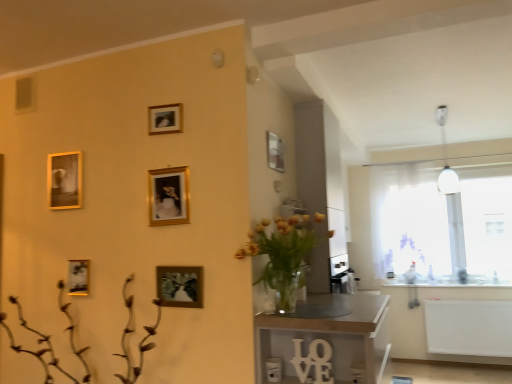
Where is `transparent glass window at right`? This screenshot has width=512, height=384. transparent glass window at right is located at coordinates (441, 224).

The image size is (512, 384). Describe the element at coordinates (165, 119) in the screenshot. I see `gold metallic picture frame at upper center, which is the first picture frame in top-to-bottom order` at that location.

The image size is (512, 384). What do you see at coordinates (413, 231) in the screenshot?
I see `white sheer curtain at right` at bounding box center [413, 231].

What do you see at coordinates (327, 338) in the screenshot? This screenshot has width=512, height=384. I see `wooden table at center` at bounding box center [327, 338].

The height and width of the screenshot is (384, 512). I want to click on wooden table at center, so click(327, 338).

What do you see at coordinates (65, 180) in the screenshot? I see `gold-framed photo at upper left, the 2th picture frame positioned from the top` at bounding box center [65, 180].

You are a GUI agent. You are given a task and a screenshot of the screen. Output one action in this format:
    pyautogui.click(x=<x>, y=<y>)
    Task: Click on the transparent glass window at right
    
    Given the screenshot: What is the action you would take?
    [441, 224]

Could you tell me if translucent glass vase at center is turned towards metallic silver frame at upper center?

No, translucent glass vase at center is not facing towards metallic silver frame at upper center.

Are translucent glass vase at center and metallic silver frame at upper center located far from each other?

No, translucent glass vase at center is in close proximity to metallic silver frame at upper center.

Which point is more distant from viewer, (284,298) or (276,152)?

The point (276,152) is farther from the camera.

Can you confirm if translucent glass vase at center is thinner than metallic silver frame at upper center?

In fact, translucent glass vase at center might be wider than metallic silver frame at upper center.

Does metallic silver frame at upper center turn towards translucent glass vase at center?

No, metallic silver frame at upper center is not turned towards translucent glass vase at center.

Is translucent glass vase at center completely or partially inside metallic silver frame at upper center?

That's incorrect, translucent glass vase at center is not inside metallic silver frame at upper center.

Considering the relative sizes of metallic silver frame at upper center and translucent glass vase at center in the image provided, is metallic silver frame at upper center bigger than translucent glass vase at center?

Incorrect, metallic silver frame at upper center is not larger than translucent glass vase at center.

Could you tell me if translucent glass vase at center is facing brown matte plant at lower left?

No, translucent glass vase at center is not turned towards brown matte plant at lower left.

Is translucent glass vase at center positioned far away from brown matte plant at lower left?

No, translucent glass vase at center is not far away from brown matte plant at lower left.

How different are the orientations of translucent glass vase at center and brown matte plant at lower left in degrees?

They differ by 90 degrees in their facing directions.

Is brown matte plant at lower left surrounded by translucent glass vase at center?

No, brown matte plant at lower left is located outside of translucent glass vase at center.

Can you confirm if gold metallic picture frame at upper center, which is the 3th picture frame in right-to-left order, is smaller than translucent glass vase at center?

Yes.

Considering their positions, is gold metallic picture frame at upper center, which is the 3th picture frame in right-to-left order, located in front of or behind translucent glass vase at center?

gold metallic picture frame at upper center, which is the 3th picture frame in right-to-left order, is behind translucent glass vase at center.

Is point (169, 126) in front of point (306, 231)?

No.

Which is correct: gold metallic picture frame at upper center, which is the third picture frame from left to right, is inside translucent glass vase at center, or outside of it?

gold metallic picture frame at upper center, which is the third picture frame from left to right, is not enclosed by translucent glass vase at center.

Based on their positions, is white sheer curtain at right located to the left or right of wooden table at center?

From the image, it's evident that white sheer curtain at right is to the right of wooden table at center.

Does white sheer curtain at right lie in front of wooden table at center?

No, it is not.

What's the angular difference between white sheer curtain at right and gold metallic picture frame at center, which is counted as the 2th picture frame, starting from the right,'s facing directions?

The angle between the facing direction of white sheer curtain at right and the facing direction of gold metallic picture frame at center, which is counted as the 2th picture frame, starting from the right, is 0.637 degrees.

In the scene shown: From a real-world perspective, is white sheer curtain at right above or below gold metallic picture frame at center, marked as the fourth picture frame in a left-to-right arrangement?

white sheer curtain at right is below gold metallic picture frame at center, marked as the fourth picture frame in a left-to-right arrangement.

Which of these two, white sheer curtain at right or gold metallic picture frame at center, arranged as the third picture frame when viewed from the top, is wider?

white sheer curtain at right is wider.

Is white sheer curtain at right facing away from gold metallic picture frame at center, arranged as the third picture frame when viewed from the top?

white sheer curtain at right does not have its back to gold metallic picture frame at center, arranged as the third picture frame when viewed from the top.

Is gold metallic picture frame at center, which ranks as the first picture frame in right-to-left order, at the left side of white sheer curtain at right?

Indeed, gold metallic picture frame at center, which ranks as the first picture frame in right-to-left order, is positioned on the left side of white sheer curtain at right.

Would you say gold metallic picture frame at center, marked as the fifth picture frame in a top-to-bottom arrangement, is inside or outside white sheer curtain at right?

gold metallic picture frame at center, marked as the fifth picture frame in a top-to-bottom arrangement, exists outside the volume of white sheer curtain at right.

Which object is further away from the camera, gold metallic picture frame at center, which is the 5th picture frame in left-to-right order, or white sheer curtain at right?

white sheer curtain at right is further away from the camera.

Identify the location of floral arrangement below the metallic silver frame at upper center (from the image's perspective). The width and height of the screenshot is (512, 384). (283, 255).

Find the location of a particular element. The image size is (512, 384). decorative picture behind the translucent glass vase at center is located at coordinates pos(275,152).

Which object lies nearer to the anchor point gold metallic picture frame at lower left, placed as the 2th picture frame when sorted from bottom to top, brown matte plant at lower left or gold metallic picture frame at center, which is the 5th picture frame in left-to-right order?

brown matte plant at lower left is positioned closer to the anchor gold metallic picture frame at lower left, placed as the 2th picture frame when sorted from bottom to top.

From the image, which object appears to be nearer to transparent glass window at right, white matte radiator at lower right or gold metallic picture frame at upper center, which is counted as the fifth picture frame, starting from the bottom?

white matte radiator at lower right is closer to transparent glass window at right.

When comparing their distances from wooden table at center, does translucent glass vase at center or gold metallic picture frame at center, marked as the third picture frame in a bottom-to-top arrangement, seem further?

Among the two, gold metallic picture frame at center, marked as the third picture frame in a bottom-to-top arrangement, is located further to wooden table at center.

Looking at the image, which one is located closer to wooden table at center, metallic silver frame at upper center or translucent glass vase at center?

Among the two, translucent glass vase at center is located nearer to wooden table at center.

Considering their positions, is gold metallic picture frame at upper center, which is the 3th picture frame in right-to-left order, positioned closer to metallic silver frame at upper center than wooden table at center?

gold metallic picture frame at upper center, which is the 3th picture frame in right-to-left order, is closer to metallic silver frame at upper center.

From the image, which object appears to be farther from gold metallic picture frame at upper center, which is counted as the fifth picture frame, starting from the bottom, gold metallic picture frame at center, which ranks as the first picture frame in right-to-left order, or wooden table at center?

wooden table at center is further to gold metallic picture frame at upper center, which is counted as the fifth picture frame, starting from the bottom.

Which object lies further to the anchor point metallic silver frame at upper center, white matte radiator at lower right or white sheer curtain at right?

white sheer curtain at right is positioned further to the anchor metallic silver frame at upper center.

Which object lies further to the anchor point brown matte plant at lower left, white matte radiator at lower right or gold metallic picture frame at center, arranged as the third picture frame when viewed from the top?

white matte radiator at lower right is further to brown matte plant at lower left.

Where is `decorative picture between gold metallic picture frame at center, marked as the fourth picture frame in a left-to-right arrangement, and translucent glass vase at center from left to right`? decorative picture between gold metallic picture frame at center, marked as the fourth picture frame in a left-to-right arrangement, and translucent glass vase at center from left to right is located at coordinates (275, 152).

I want to click on decorative picture situated between gold-framed photo at upper left, the 1th picture frame from the left, and wooden table at center from left to right, so click(275, 152).

Identify the location of decorative picture situated between gold metallic picture frame at lower left, the fourth picture frame positioned from the top, and translucent glass vase at center from left to right. (275, 152).

The height and width of the screenshot is (384, 512). I want to click on floral arrangement between brown matte plant at lower left and white sheer curtain at right from front to back, so click(283, 255).